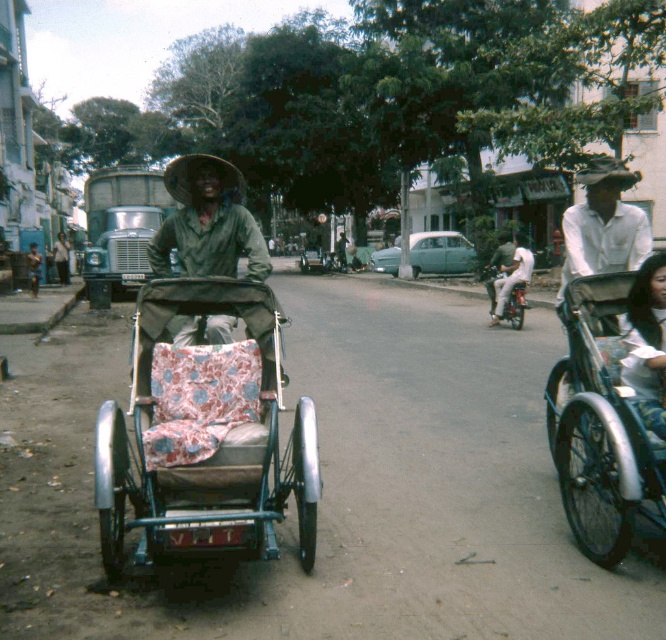
You are a tourist in this tropical area and want to take a photo of the patterned fabric tricycle at center and the white fabric shirt at center. Which object should you focus on first to ensure both are in the frame?

You should focus on the white fabric shirt at center first because the patterned fabric tricycle at center is located above it, so adjusting the camera to include the lower object ensures both are captured.